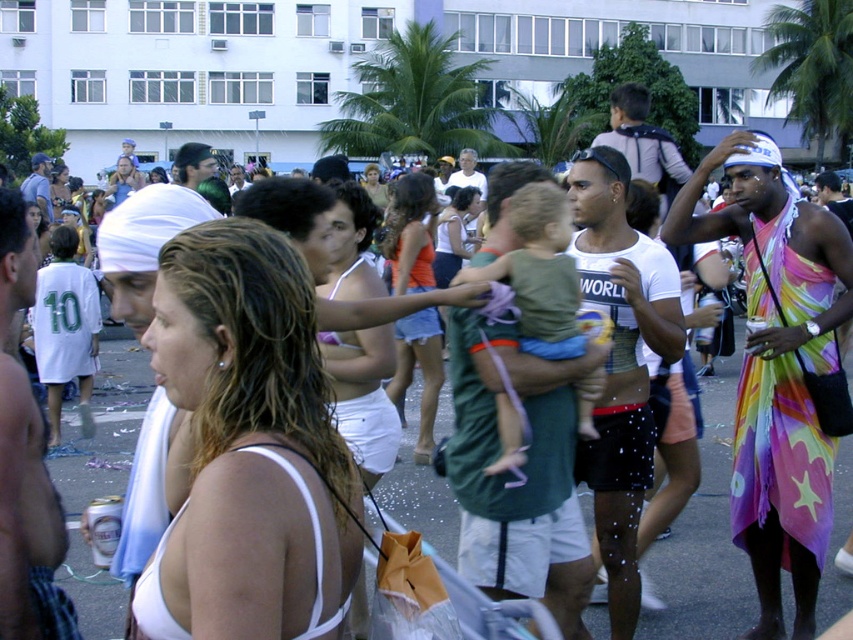
Is point (532, 225) in front of point (412, 196)?

That is True.

Is point (498, 428) positioned behind point (413, 452)?

No, it is not.

This screenshot has width=853, height=640. In order to click on green cotton shirt at center in this screenshot , I will do `click(538, 273)`.

This screenshot has width=853, height=640. In order to click on white fabric bikini top at center in this screenshot , I will do coord(250,440).

The width and height of the screenshot is (853, 640). Find the location of `white fabric bikini top at center`. white fabric bikini top at center is located at coordinates (250, 440).

At what (x,y) coordinates should I click in order to perform the action: click on white fabric bikini top at center. Please return your answer as a coordinate pair (x, y). This screenshot has height=640, width=853. Looking at the image, I should click on (250, 440).

Between rainbow fabric dress at right and green cotton shirt at center, which one has less height?

green cotton shirt at center is shorter.

Can you confirm if rainbow fabric dress at right is wider than green cotton shirt at center?

Yes, rainbow fabric dress at right is wider than green cotton shirt at center.

Locate an element on the screen. The height and width of the screenshot is (640, 853). rainbow fabric dress at right is located at coordinates (776, 365).

You are a GUI agent. You are given a task and a screenshot of the screen. Output one action in this format:
    pyautogui.click(x=<x>, y=<y>)
    Task: Click on the rainbow fabric dress at right
    The height and width of the screenshot is (640, 853).
    Given the screenshot: What is the action you would take?
    pyautogui.click(x=776, y=365)